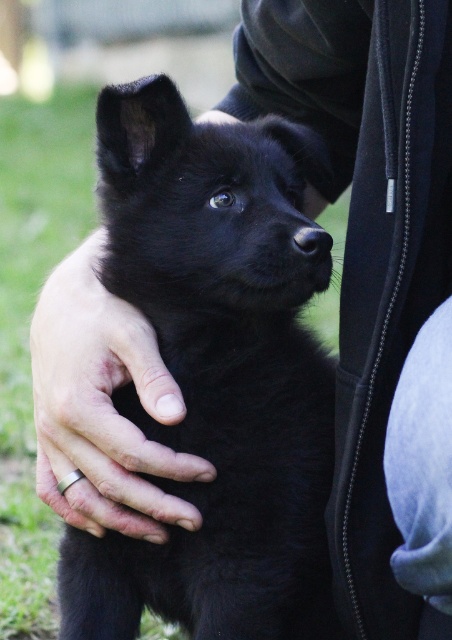
Who is more forward, (281, 595) or (74, 502)?

Point (281, 595) is in front.

Is the position of black furry dog at center more distant than that of silver metallic ring at lower left?

No, black furry dog at center is closer to the viewer.

The width and height of the screenshot is (452, 640). Find the location of `black furry dog at center`. black furry dog at center is located at coordinates (216, 374).